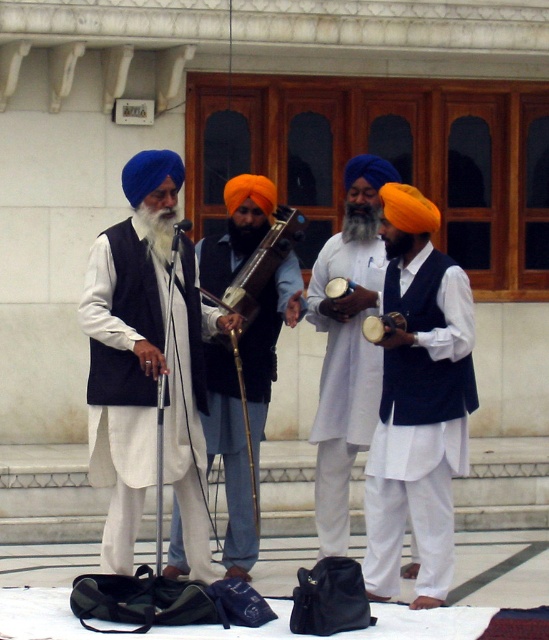
Based on the photo, does white cotton drum at center appear on the left side of wooden polished instrument at center?

In fact, white cotton drum at center is to the right of wooden polished instrument at center.

Which is above, white cotton drum at center or wooden polished instrument at center?

wooden polished instrument at center is above.

At what (x,y) coordinates should I click in order to perform the action: click on white cotton drum at center. Please return your answer as a coordinate pair (x, y). This screenshot has height=640, width=549. Looking at the image, I should click on (419, 422).

Where is `white cotton drum at center`? The image size is (549, 640). white cotton drum at center is located at coordinates (419, 422).

Which is above, matte wood drum at center or wooden polished instrument at center?

wooden polished instrument at center

Between point (332, 337) and point (249, 228), which one is positioned in front?

Point (249, 228) is in front.

Where is `matte wood drum at center`? matte wood drum at center is located at coordinates (346, 346).

Between point (236, 221) and point (372, 244), which one is positioned in front?

Point (236, 221) is more forward.

Can you confirm if matte black turban at center is positioned above matte wood drum at center?

No, matte black turban at center is not above matte wood drum at center.

Between point (173, 566) and point (358, 346), which one is positioned in front?

Point (173, 566) is more forward.

Where is `matte black turban at center`? matte black turban at center is located at coordinates (229, 458).